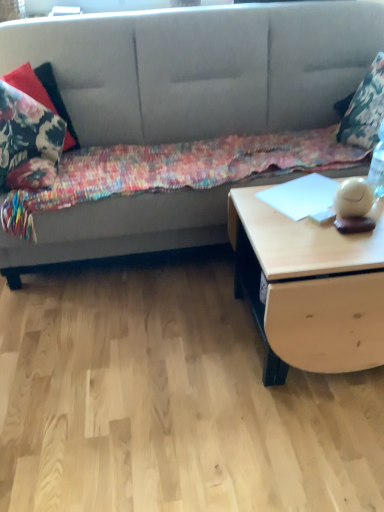
Question: Can you confirm if floral fabric pillow at upper right, placed as the 1th pillow when sorted from right to left, is taller than floral fabric blanket at center?

Choices:
 (A) no
 (B) yes

Answer: (B)

Question: Is floral fabric pillow at upper right, placed as the 1th pillow when sorted from right to left, far away from floral fabric blanket at center?

Choices:
 (A) yes
 (B) no

Answer: (B)

Question: Is floral fabric pillow at upper right, the 2th pillow positioned from the left, oriented towards floral fabric blanket at center?

Choices:
 (A) yes
 (B) no

Answer: (A)

Question: From the image's perspective, does floral fabric pillow at upper right, the 2th pillow positioned from the left, appear higher than floral fabric blanket at center?

Choices:
 (A) no
 (B) yes

Answer: (B)

Question: Is floral fabric pillow at upper right, the 2th pillow positioned from the left, positioned with its back to floral fabric blanket at center?

Choices:
 (A) yes
 (B) no

Answer: (B)

Question: Would you say floral fabric pillow at left, the second pillow positioned from the right, is to the left or to the right of floral fabric blanket at center in the picture?

Choices:
 (A) right
 (B) left

Answer: (B)

Question: Is floral fabric pillow at left, the second pillow positioned from the right, inside or outside of floral fabric blanket at center?

Choices:
 (A) outside
 (B) inside

Answer: (A)

Question: From a real-world perspective, is floral fabric pillow at left, the second pillow positioned from the right, positioned above or below floral fabric blanket at center?

Choices:
 (A) above
 (B) below

Answer: (A)

Question: Does point (14, 84) appear closer or farther from the camera than point (286, 138)?

Choices:
 (A) closer
 (B) farther

Answer: (A)

Question: In terms of height, does floral fabric pillow at upper right, placed as the 1th pillow when sorted from right to left, look taller or shorter compared to floral fabric blanket at center?

Choices:
 (A) short
 (B) tall

Answer: (B)

Question: Considering the positions of point (365, 79) and point (33, 228), is point (365, 79) closer or farther from the camera than point (33, 228)?

Choices:
 (A) closer
 (B) farther

Answer: (B)

Question: Considering the positions of floral fabric pillow at upper right, placed as the 1th pillow when sorted from right to left, and floral fabric blanket at center in the image, is floral fabric pillow at upper right, placed as the 1th pillow when sorted from right to left, bigger or smaller than floral fabric blanket at center?

Choices:
 (A) big
 (B) small

Answer: (B)

Question: From a real-world perspective, is floral fabric pillow at upper right, placed as the 1th pillow when sorted from right to left, above or below floral fabric blanket at center?

Choices:
 (A) above
 (B) below

Answer: (A)

Question: Based on their sizes in the image, would you say light wood/texture table at right is bigger or smaller than floral fabric pillow at upper right, placed as the 1th pillow when sorted from right to left?

Choices:
 (A) big
 (B) small

Answer: (A)

Question: Would you say light wood/texture table at right is inside or outside floral fabric pillow at upper right, the 2th pillow positioned from the left?

Choices:
 (A) inside
 (B) outside

Answer: (B)